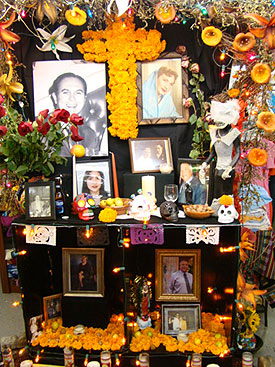
Image resolution: width=275 pixels, height=367 pixels. I want to click on black frame, so click(x=52, y=209).